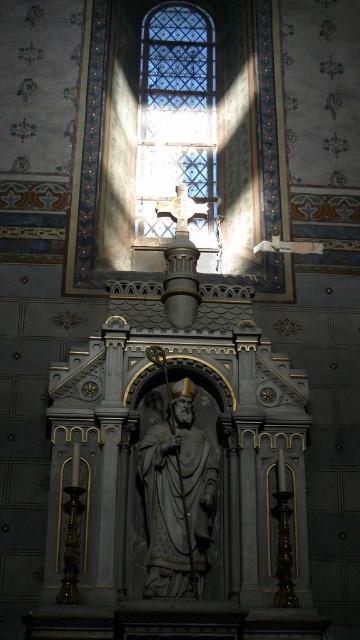
Question: Which object appears farthest from the camera in this image?

Choices:
 (A) clear glass cross at upper center
 (B) white marble statue at center

Answer: (A)

Question: Is clear glass cross at upper center bigger than white marble statue at center?

Choices:
 (A) yes
 (B) no

Answer: (A)

Question: Among these points, which one is nearest to the camera?

Choices:
 (A) (200, 529)
 (B) (154, 106)

Answer: (A)

Question: Where is clear glass cross at upper center located in relation to white marble statue at center in the image?

Choices:
 (A) below
 (B) above

Answer: (B)

Question: Which object appears closest to the camera in this image?

Choices:
 (A) white marble statue at center
 (B) clear glass cross at upper center

Answer: (A)

Question: Is clear glass cross at upper center to the right of white marble statue at center from the viewer's perspective?

Choices:
 (A) no
 (B) yes

Answer: (A)